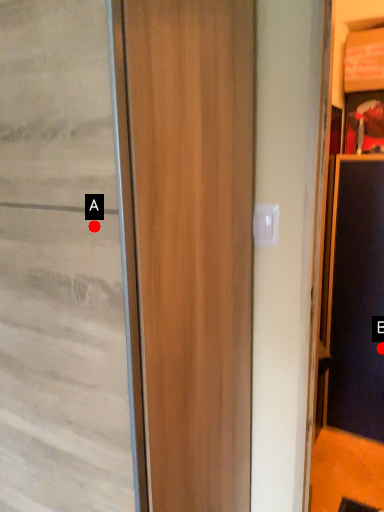
Question: Two points are circled on the image, labeled by A and B beside each circle. Which point is closer to the camera?

Choices:
 (A) A is closer
 (B) B is closer

Answer: (A)